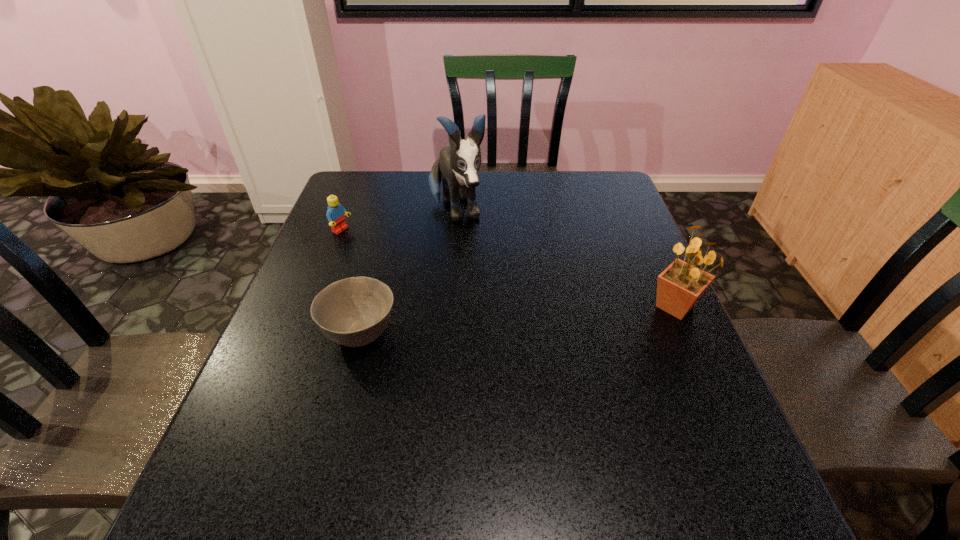
Locate an element on the screen. Image resolution: width=960 pixels, height=540 pixels. vacant space that is in between the sunflower and the tallest object is located at coordinates (565, 259).

I want to click on free space between the Lego and the rightmost object, so click(508, 268).

This screenshot has width=960, height=540. I want to click on object that is the closest one to the tallest object, so [x=335, y=214].

At what (x,y) coordinates should I click in order to perform the action: click on the third closest object to the puppy. Please return your answer as a coordinate pair (x, y). This screenshot has height=540, width=960. Looking at the image, I should click on (681, 284).

At what (x,y) coordinates should I click in order to perform the action: click on blank space that satisfies the following two spatial constraints: 1. on the front side of the second object from left to right; 2. on the right side of the Lego. Please return your answer as a coordinate pair (x, y). Looking at the image, I should click on (301, 334).